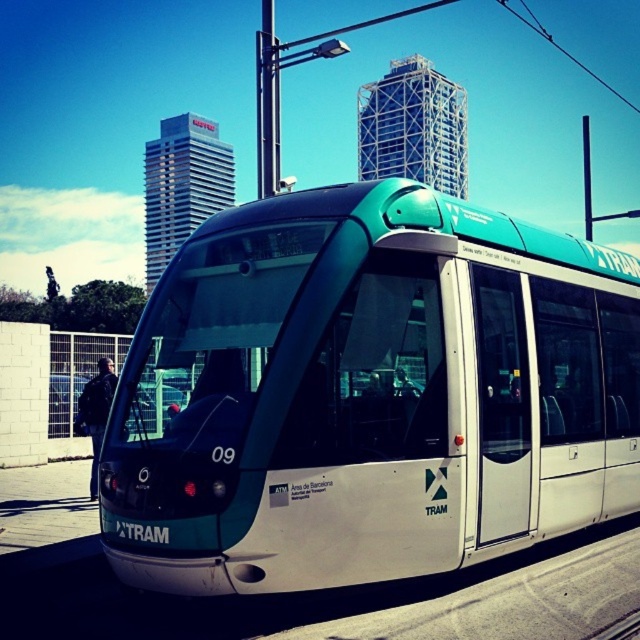
Between teal glossy tram at center and black leather jacket at left, which one is positioned lower?

black leather jacket at left is lower down.

How distant is teal glossy tram at center from black leather jacket at left?

A distance of 21.30 feet exists between teal glossy tram at center and black leather jacket at left.

Between point (440, 502) and point (108, 404), which one is positioned in front?

Positioned in front is point (440, 502).

Locate an element on the screen. The height and width of the screenshot is (640, 640). teal glossy tram at center is located at coordinates (371, 396).